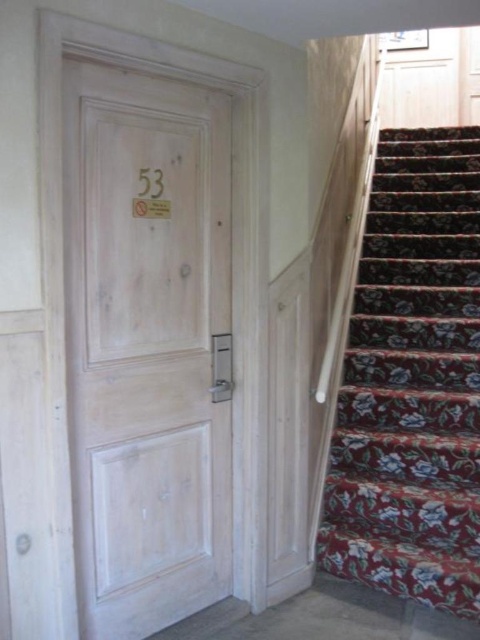
You are a delivery person trying to determine the best way to carry a large package through the hallway. The white wood door at center and the floral carpet at right are in your path. Which object should you avoid if you need to maneuver around something larger?

You should avoid the floral carpet at right since the white wood door at center is smaller than the floral carpet at right, meaning the floral carpet occupies more space and would require more careful maneuvering around it.

Looking at this image, you are standing in the hallway and see two points marked in the image. The first point is at coordinate point (203,394) and the second is at point (395,378). Which point is closer to you?

Point (203,394) is closer to the camera than point (395,378).

You are standing in a hallway and want to locate the white wood door at center. According to the coordinates provided, where would you find it?

The white wood door at center is located at coordinates point (147,346).